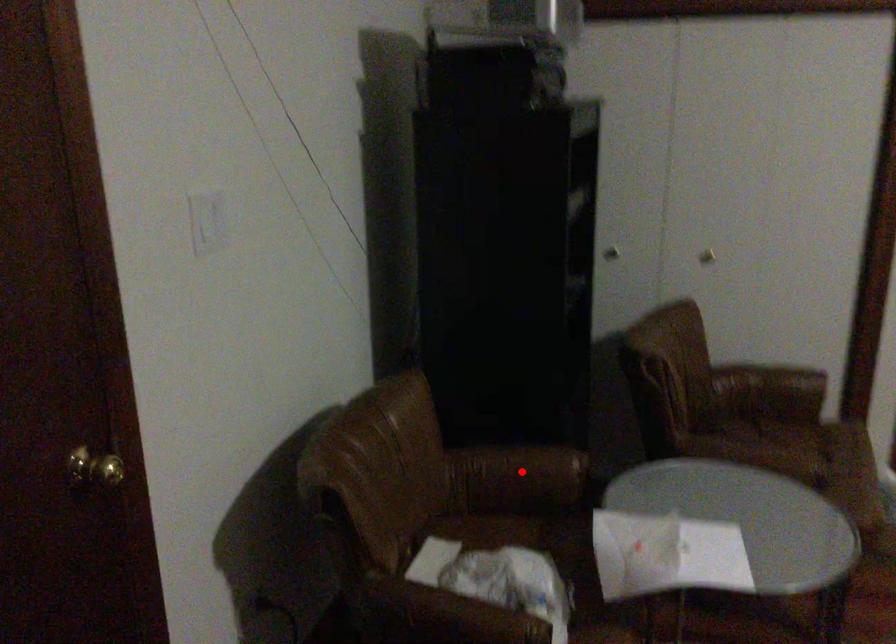
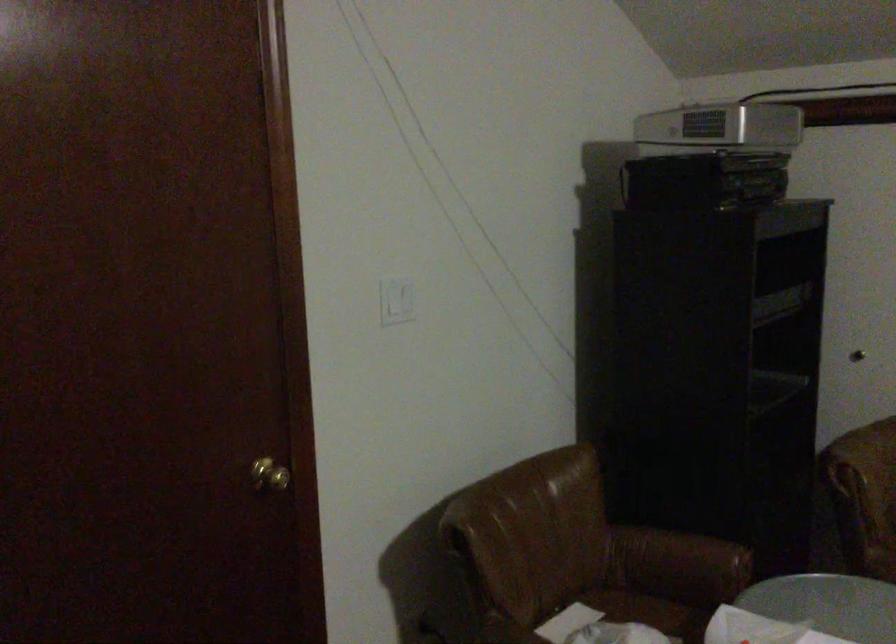
Where in the second image is the point corresponding to the highlighted location from the first image?

(679, 559)